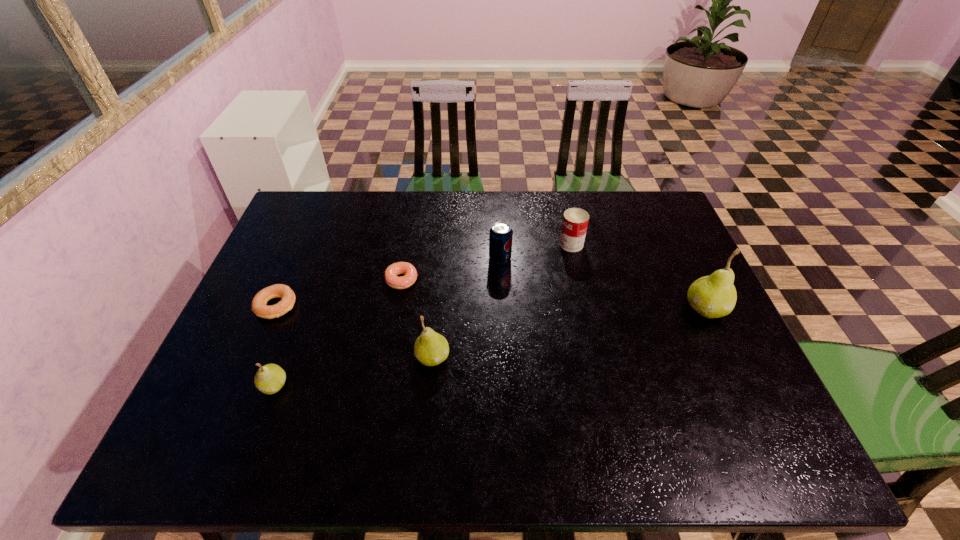
This screenshot has height=540, width=960. I want to click on vacant area at the near right corner, so click(698, 404).

The image size is (960, 540). I want to click on free space between the third object from left to right and the tallest pear, so click(554, 294).

Where is `blank region between the farthest pear and the leftmost pear`? The image size is (960, 540). blank region between the farthest pear and the leftmost pear is located at coordinates (490, 347).

Identify the location of vacant area that lies between the bagel and the second pear from left to right. (354, 332).

The width and height of the screenshot is (960, 540). What are the coordinates of `blank region between the nearest object and the rightmost pear` in the screenshot? It's located at click(x=490, y=347).

Find the location of a particular element. This screenshot has width=960, height=540. free area in between the sixth object from left to right and the farthest pear is located at coordinates (638, 276).

Locate an element on the screen. The height and width of the screenshot is (540, 960). vacant space that is in between the soda can and the tallest object is located at coordinates (603, 284).

Where is `empty location between the doughnut and the bagel`? empty location between the doughnut and the bagel is located at coordinates (339, 293).

At what (x,y) coordinates should I click in order to perform the action: click on vacant area between the soda can and the tallest pear. Please return your answer as a coordinate pair (x, y). Looking at the image, I should click on (603, 284).

This screenshot has width=960, height=540. Find the location of `free space between the second shortest pear and the can`. free space between the second shortest pear and the can is located at coordinates (502, 301).